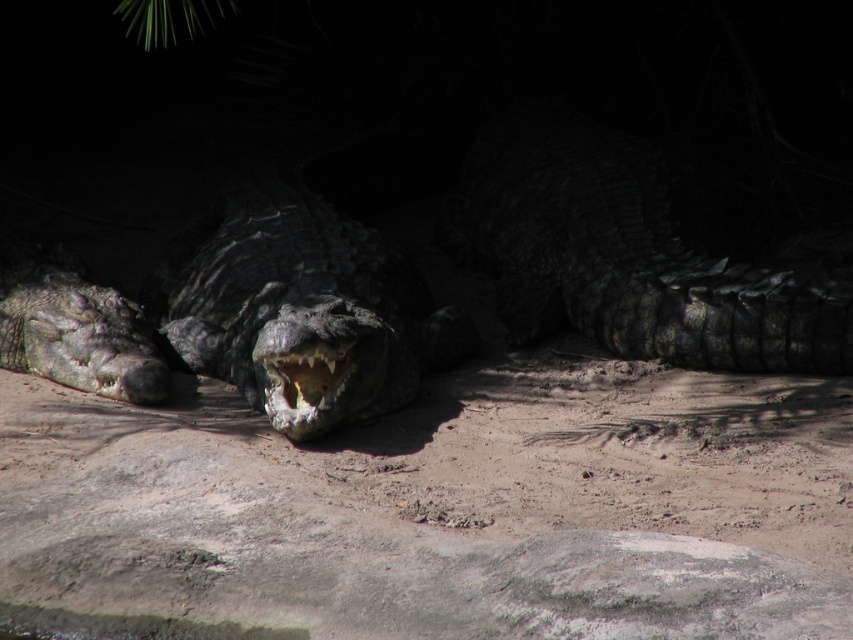
Based on the scene description, which crocodile is positioned higher up in the image, the dark scaly crocodile at center or the shiny black crocodile at center?

The dark scaly crocodile at center is positioned above the shiny black crocodile at center in the image.

You are a wildlife photographer aiming to capture a clear photo of the shiny black crocodile at center and the dark gray scaly crocodile at left. Based on their positions, which crocodile will appear larger in the photo?

The shiny black crocodile at center will appear larger in the photo because it is positioned in front of the dark gray scaly crocodile at left, making it closer to the camera.